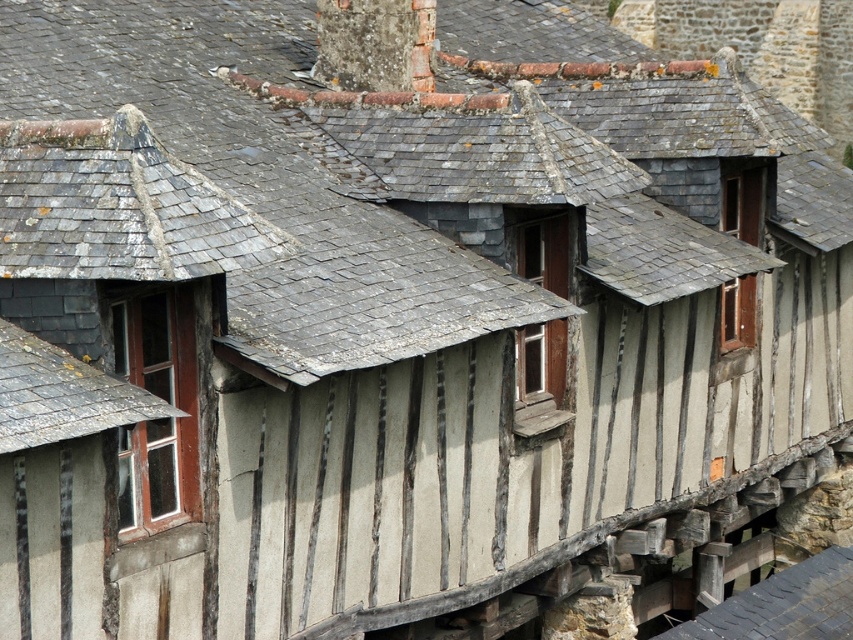
Question: Which object appears closest to the camera in this image?

Choices:
 (A) gray slate roof at lower left
 (B) brown wooden window at center
 (C) wooden-framed window at left

Answer: (A)

Question: Which of these objects is positioned farthest from the gray slate roof at lower left?

Choices:
 (A) wooden window at center-right
 (B) wooden-framed window at left

Answer: (A)

Question: In this image, where is wooden-framed window at left located relative to gray slate roof at lower left?

Choices:
 (A) right
 (B) left

Answer: (A)

Question: Is brown wooden window at center to the left of wooden window at center-right from the viewer's perspective?

Choices:
 (A) no
 (B) yes

Answer: (B)

Question: Does brown wooden window at center appear under wooden window at center-right?

Choices:
 (A) no
 (B) yes

Answer: (B)

Question: Which object is closer to the camera taking this photo?

Choices:
 (A) gray slate roof at lower left
 (B) wooden window at center-right

Answer: (A)